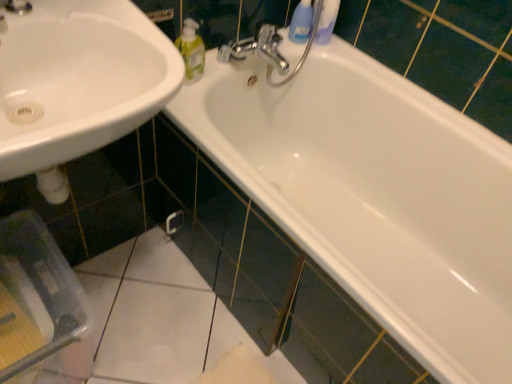
Question: Would you say chrome metallic faucet at upper center is a long distance from white glossy sink at lower left?

Choices:
 (A) no
 (B) yes

Answer: (A)

Question: Does chrome metallic faucet at upper center turn towards white glossy sink at lower left?

Choices:
 (A) yes
 (B) no

Answer: (B)

Question: Is chrome metallic faucet at upper center not inside white glossy sink at lower left?

Choices:
 (A) no
 (B) yes

Answer: (B)

Question: Can you confirm if chrome metallic faucet at upper center is wider than white glossy sink at lower left?

Choices:
 (A) yes
 (B) no

Answer: (B)

Question: From the image's perspective, does chrome metallic faucet at upper center appear lower than white glossy sink at lower left?

Choices:
 (A) no
 (B) yes

Answer: (A)

Question: Considering the relative sizes of chrome metallic faucet at upper center and white glossy sink at lower left in the image provided, is chrome metallic faucet at upper center smaller than white glossy sink at lower left?

Choices:
 (A) no
 (B) yes

Answer: (B)

Question: Is white glossy sink at lower left positioned with its back to white glossy bathtub at upper center?

Choices:
 (A) yes
 (B) no

Answer: (B)

Question: Is there a large distance between white glossy sink at lower left and white glossy bathtub at upper center?

Choices:
 (A) no
 (B) yes

Answer: (A)

Question: From the image's perspective, would you say white glossy sink at lower left is shown under white glossy bathtub at upper center?

Choices:
 (A) no
 (B) yes

Answer: (A)

Question: Does white glossy sink at lower left appear on the left side of white glossy bathtub at upper center?

Choices:
 (A) no
 (B) yes

Answer: (B)

Question: From a real-world perspective, is white glossy sink at lower left on top of white glossy bathtub at upper center?

Choices:
 (A) yes
 (B) no

Answer: (A)

Question: From a real-world perspective, does white glossy sink at lower left sit lower than white glossy bathtub at upper center?

Choices:
 (A) no
 (B) yes

Answer: (A)

Question: Does translucent plastic bottle at upper center appear on the left side of white glossy bathtub at upper center?

Choices:
 (A) no
 (B) yes

Answer: (B)